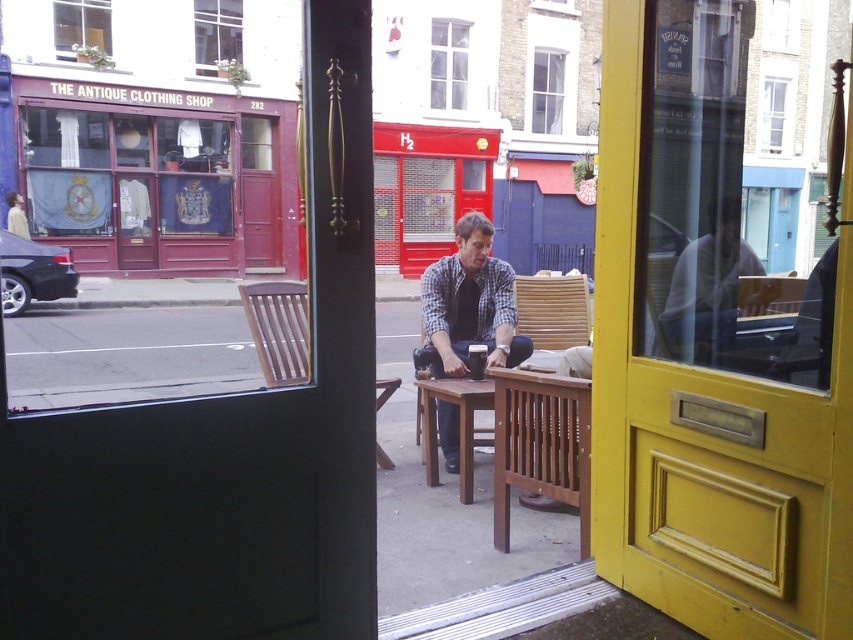
Who is higher up, checkered fabric shirt at center or bamboo chair at center?

bamboo chair at center is above.

How much distance is there between checkered fabric shirt at center and bamboo chair at center?

checkered fabric shirt at center is 21.01 inches from bamboo chair at center.

Is point (457, 278) closer to viewer compared to point (579, 326)?

That is True.

You are a GUI agent. You are given a task and a screenshot of the screen. Output one action in this format:
    pyautogui.click(x=<x>, y=<y>)
    Task: Click on the checkered fabric shirt at center
    
    Given the screenshot: What is the action you would take?
    pyautogui.click(x=469, y=304)

Is point (292, 384) positioned in front of point (515, 282)?

Yes, point (292, 384) is in front of point (515, 282).

How far apart are wooden slats chair at left and bamboo chair at center?

wooden slats chair at left is 1.63 meters away from bamboo chair at center.

Find the location of a particular element. wooden slats chair at left is located at coordinates (277, 330).

This screenshot has height=640, width=853. I want to click on wooden slats chair at left, so click(277, 330).

From the picture: Is white cotton shirt at upper right taller than wooden slats chair at left?

Yes.

Who is lower down, white cotton shirt at upper right or wooden slats chair at left?

Positioned lower is wooden slats chair at left.

You are a GUI agent. You are given a task and a screenshot of the screen. Output one action in this format:
    pyautogui.click(x=<x>, y=<y>)
    Task: Click on the white cotton shirt at upper right
    This screenshot has width=853, height=640.
    Given the screenshot: What is the action you would take?
    pyautogui.click(x=706, y=289)